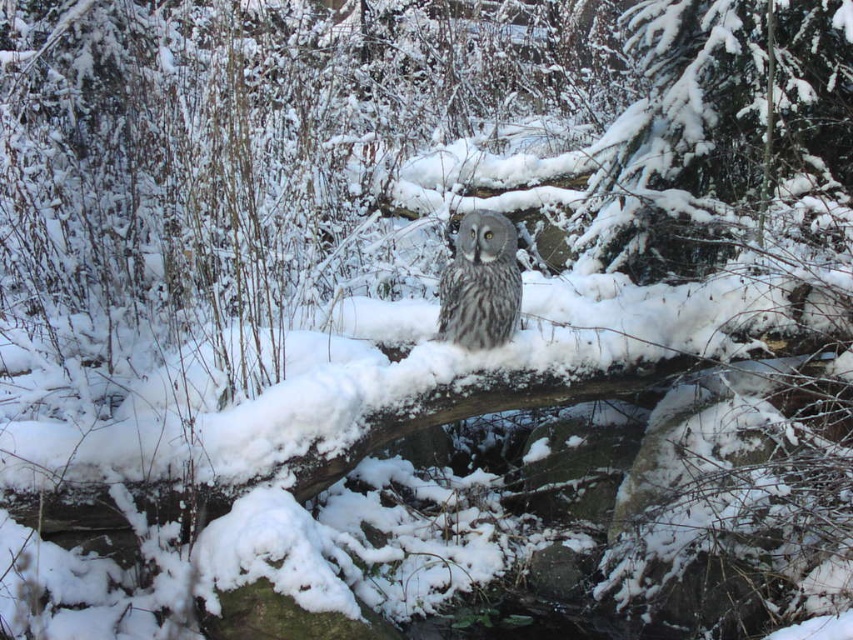
Question: Is the position of snow-covered evergreen tree at center less distant than that of gray speckled owl at center?

Choices:
 (A) no
 (B) yes

Answer: (A)

Question: Which object appears closest to the camera in this image?

Choices:
 (A) snow-covered evergreen tree at center
 (B) gray speckled owl at center

Answer: (B)

Question: Which point is farther to the camera?

Choices:
 (A) (624, 45)
 (B) (505, 282)

Answer: (A)

Question: Does snow-covered evergreen tree at center appear over gray speckled owl at center?

Choices:
 (A) no
 (B) yes

Answer: (B)

Question: Is the position of snow-covered evergreen tree at center more distant than that of gray speckled owl at center?

Choices:
 (A) yes
 (B) no

Answer: (A)